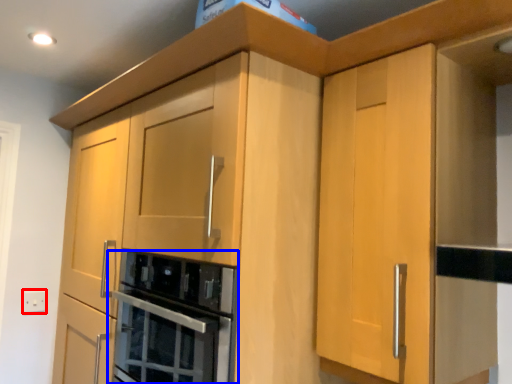
Question: Among these objects, which one is nearest to the camera, electric outlet (highlighted by a red box) or home appliance (highlighted by a blue box)?

Choices:
 (A) electric outlet
 (B) home appliance

Answer: (B)